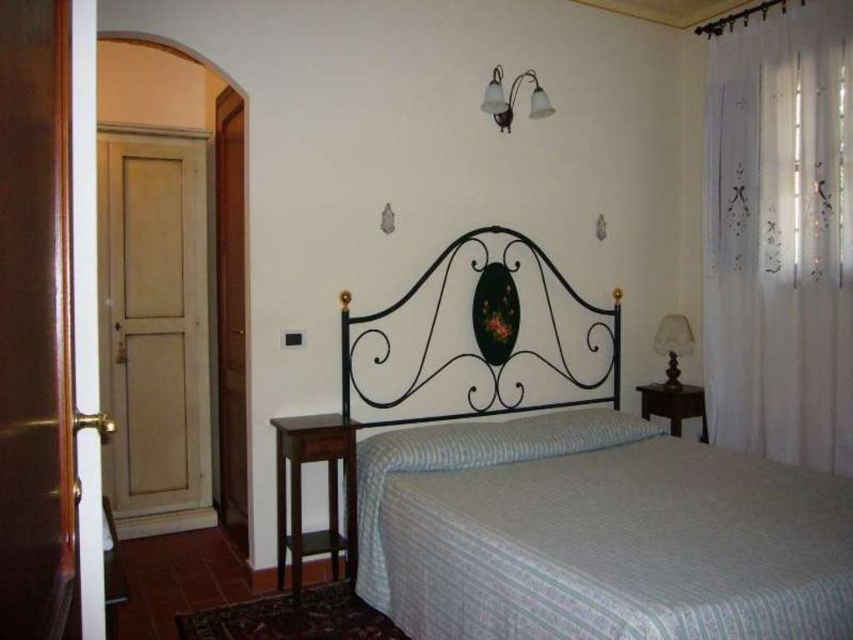
Question: Can you confirm if white sheer curtain at right is positioned below white glass wall sconce at upper center?

Choices:
 (A) no
 (B) yes

Answer: (B)

Question: Which point appears closest to the camera in this image?

Choices:
 (A) (851, 128)
 (B) (546, 316)

Answer: (A)

Question: Considering the real-world distances, which object is closest to the black wrought iron headboard at center?

Choices:
 (A) white sheer curtain at right
 (B) translucent fabric lampshade at right

Answer: (B)

Question: Can you confirm if white sheer curtain at right is bigger than translucent fabric lampshade at right?

Choices:
 (A) yes
 (B) no

Answer: (A)

Question: Which of the following is the closest to the observer?

Choices:
 (A) white glass wall sconce at upper center
 (B) white striped fabric bed at center
 (C) black wrought iron headboard at center

Answer: (B)

Question: Is white striped fabric bed at center thinner than black wrought iron headboard at center?

Choices:
 (A) no
 (B) yes

Answer: (A)